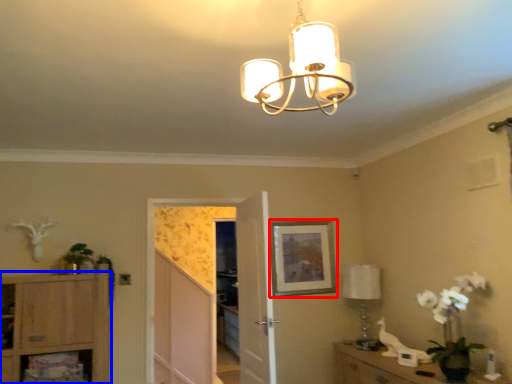
Question: Which object is closer to the camera taking this photo, picture frame (highlighted by a red box) or cabinetry (highlighted by a blue box)?

Choices:
 (A) picture frame
 (B) cabinetry

Answer: (B)